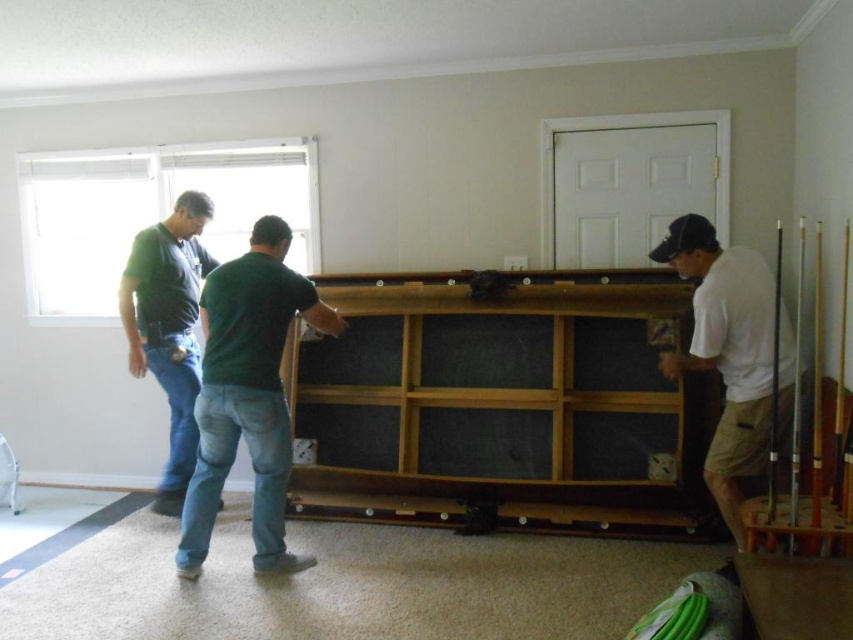
Can you confirm if green matte shirt at center is positioned to the left of white cotton shirt at right?

Correct, you'll find green matte shirt at center to the left of white cotton shirt at right.

Who is higher up, green matte shirt at center or white cotton shirt at right?

white cotton shirt at right is higher up.

Between point (199, 412) and point (720, 269), which one is positioned in front?

Positioned in front is point (720, 269).

Identify the location of green matte shirt at center. (248, 394).

Is green matte shirt at center further to the viewer compared to matte black shirt at left?

That is False.

Between green matte shirt at center and matte black shirt at left, which one is positioned lower?

green matte shirt at center is lower down.

Does point (264, 438) come farther from viewer compared to point (171, 356)?

No, (264, 438) is in front of (171, 356).

Where is `green matte shirt at center`? This screenshot has height=640, width=853. green matte shirt at center is located at coordinates (248, 394).

Is white cotton shirt at right to the right of matte black shirt at left from the viewer's perspective?

Indeed, white cotton shirt at right is positioned on the right side of matte black shirt at left.

Between point (724, 480) and point (158, 340), which one is positioned behind?

The point (158, 340) is behind.

This screenshot has width=853, height=640. What do you see at coordinates (730, 353) in the screenshot?
I see `white cotton shirt at right` at bounding box center [730, 353].

This screenshot has height=640, width=853. Find the location of `white cotton shirt at right`. white cotton shirt at right is located at coordinates (730, 353).